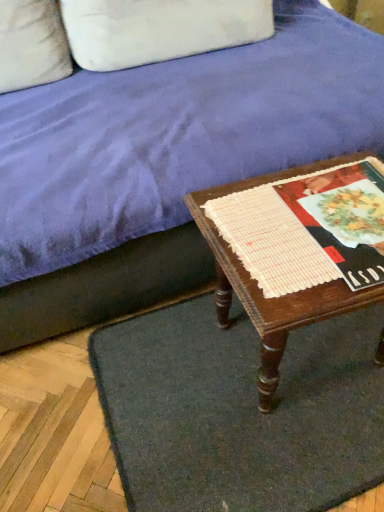
You are a GUI agent. You are given a task and a screenshot of the screen. Output one action in this format:
    pyautogui.click(x=<x>, y=<y>)
    Task: Click on the free space above wooden table at lower right (from a real-world perspective)
    The image size is (384, 512).
    Given the screenshot: What is the action you would take?
    pyautogui.click(x=315, y=218)